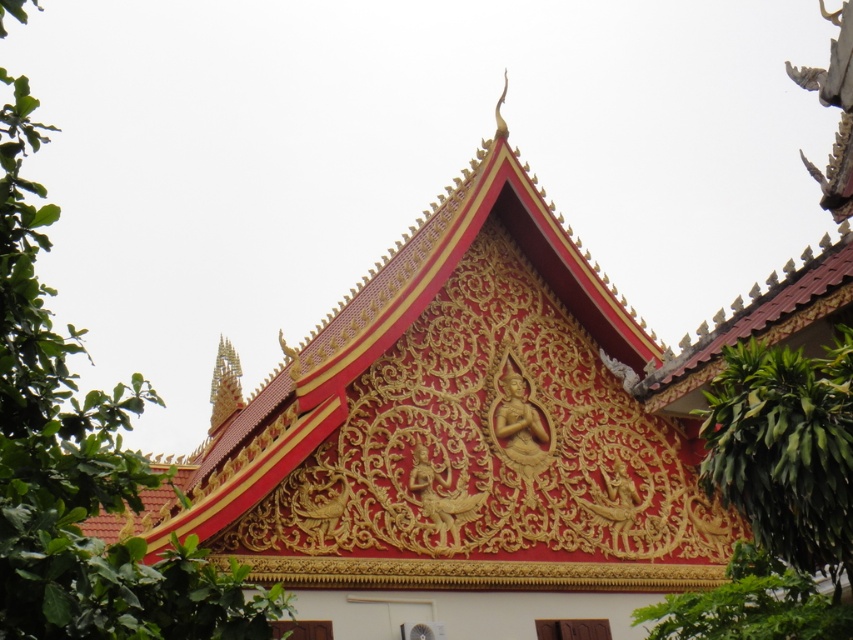
Does green leafy tree at left have a greater width compared to green leafy tree at right?

Indeed, green leafy tree at left has a greater width compared to green leafy tree at right.

Where is `green leafy tree at left`? green leafy tree at left is located at coordinates (82, 465).

Based on the photo, measure the distance between green leafy tree at left and camera.

green leafy tree at left and camera are 98.30 feet apart.

Where is `green leafy tree at left`? The width and height of the screenshot is (853, 640). green leafy tree at left is located at coordinates (82, 465).